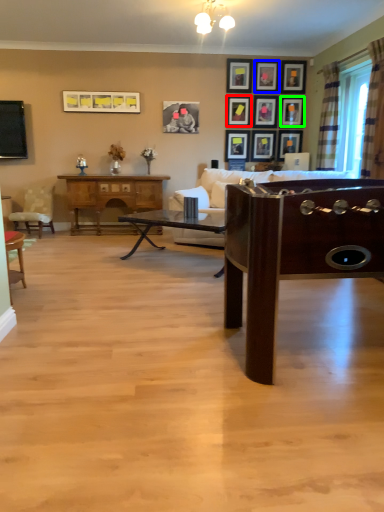
Question: Which is farther away from picture frame (highlighted by a red box)? picture frame (highlighted by a blue box) or picture frame (highlighted by a green box)?

Choices:
 (A) picture frame
 (B) picture frame

Answer: (B)